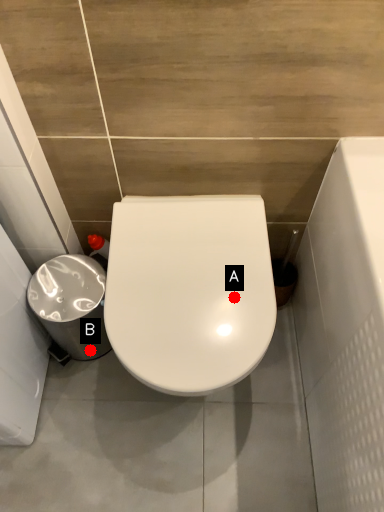
Question: Two points are circled on the image, labeled by A and B beside each circle. Which point is farther from the camera taking this photo?

Choices:
 (A) A is further
 (B) B is further

Answer: (B)